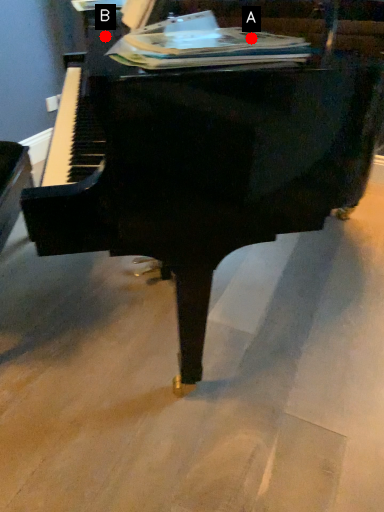
Question: Two points are circled on the image, labeled by A and B beside each circle. Among these points, which one is nearest to the camera?

Choices:
 (A) A is closer
 (B) B is closer

Answer: (A)